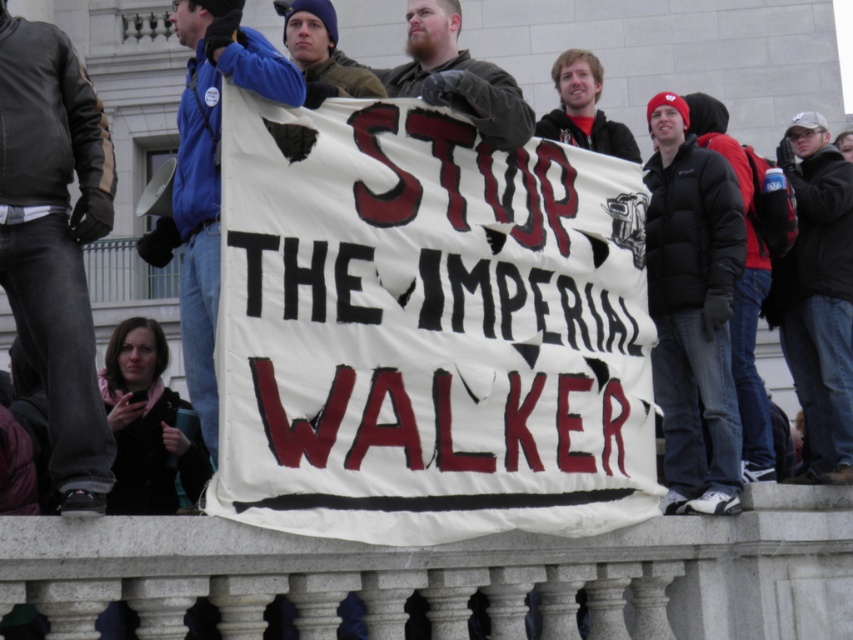
You are a photographer trying to capture a clear shot of the brown woolen hat at upper center and the blue fleece jacket at center. Based on their positions, which object should you focus on first to ensure both are in frame?

The blue fleece jacket at center is to the left of the brown woolen hat at upper center, so you should focus on the brown woolen hat at upper center first as it is positioned higher up, ensuring both remain in frame.

You are a photographer trying to capture the banner clearly. You notice two items in the frame that might distract from the banner. Which item is closer to the banner? The black puffy jacket at center or the brown woolen hat at upper center?

The black puffy jacket at center is to the right of the brown woolen hat at upper center, so the brown woolen hat at upper center is closer to the banner.

You are a photographer trying to capture the banner in the protest. You notice a point at coordinates (209,176) on your camera screen. What object is located at that point?

The point at coordinates (209,176) corresponds to the blue fleece jacket at center.